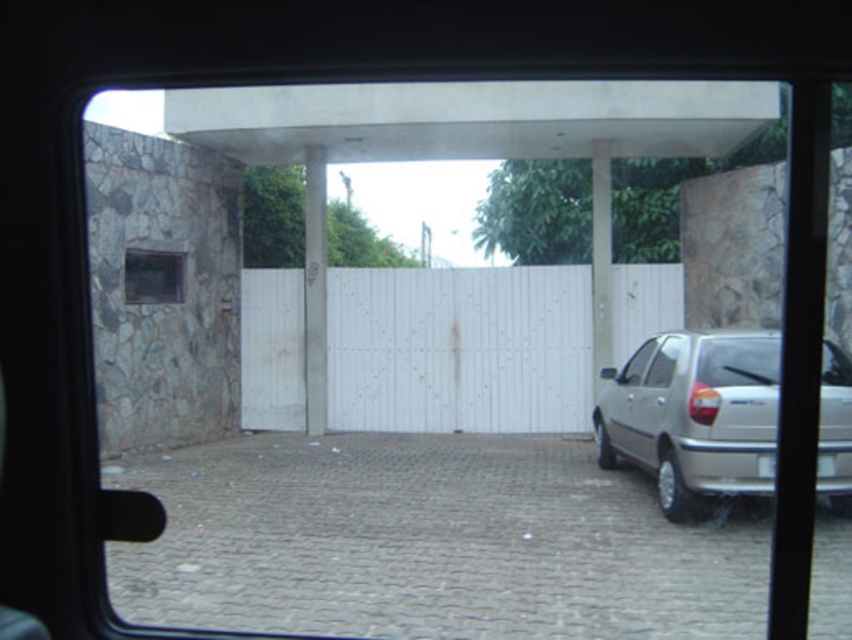
You are driving a car and need to park in the gray cobblestone driveway at center. The white plastic license plate at lower right is blocking your view. Is the driveway below the license plate visible enough for you to safely park?

The gray cobblestone driveway at center is below the white plastic license plate at lower right, so the license plate may block your view of the driveway. It might be difficult to see the driveway clearly, so proceed with caution.

You are driving a car and need to check the license plate number to ensure it matches the rental agreement. The white plastic license plate at lower right is partially obscured by a hanging object. To get a clear view, should you look above or below the white smooth pole at center?

The white smooth pole at center is above the white plastic license plate at lower right, so you should look below the white smooth pole at center to see the license plate clearly.

You are driving a car and need to exit through the gate. There are two points marked on the image. The first point is at coordinates point (x=412, y=465) and the second is at point (x=827, y=456). Which point is closer to your car?

Point (x=827, y=456) is closer to the car because it is less further to the camera than point (x=412, y=465).